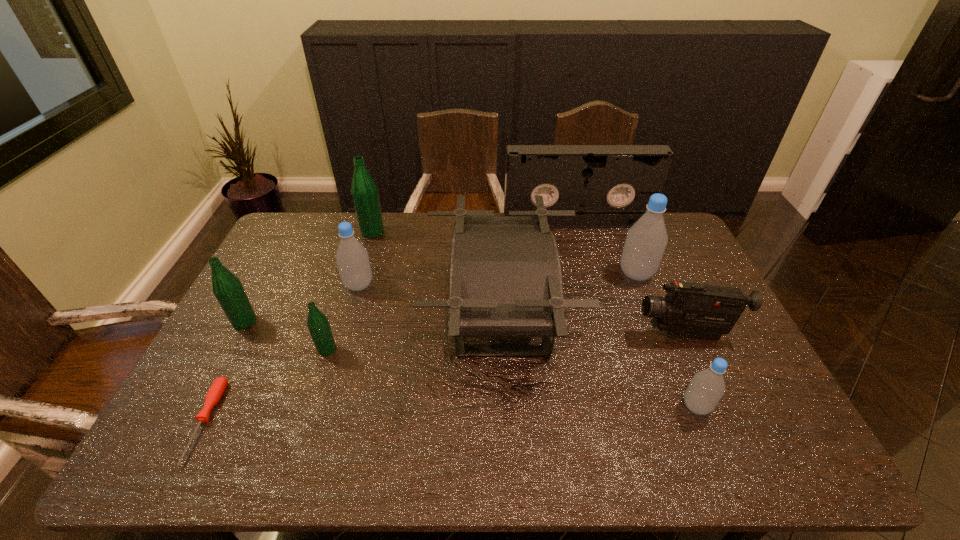
This screenshot has height=540, width=960. Find the location of `bottle positioned at the left edge`. bottle positioned at the left edge is located at coordinates (227, 288).

Locate an element on the screen. This screenshot has height=540, width=960. screwdriver present at the left edge is located at coordinates tap(218, 387).

Where is `videotape at the right edge`? Image resolution: width=960 pixels, height=540 pixels. videotape at the right edge is located at coordinates (608, 186).

I want to click on bottle that is positioned at the right edge, so click(x=646, y=240).

The width and height of the screenshot is (960, 540). In order to click on camcorder present at the right edge in this screenshot , I will do 689,309.

Where is `object that is positioned at the near left corner`? The height and width of the screenshot is (540, 960). object that is positioned at the near left corner is located at coordinates (218, 387).

The height and width of the screenshot is (540, 960). Identify the location of object present at the far right corner. (608, 186).

This screenshot has width=960, height=540. Identify the location of free region at the far edge of the desktop. (575, 237).

Find the location of `vacant space at the near edge of the desktop`. vacant space at the near edge of the desktop is located at coordinates (463, 468).

This screenshot has height=540, width=960. What are the coordinates of `blank space at the left edge` in the screenshot? It's located at (219, 424).